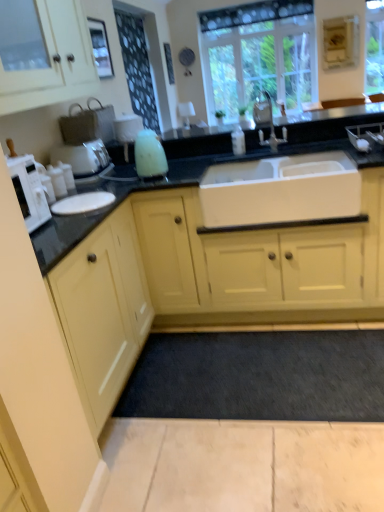
Question: Considering the positions of black granite countertop at center and matte yellow cabinet at left, the 1th cabinetry in the bottom-to-top sequence, in the image, is black granite countertop at center taller or shorter than matte yellow cabinet at left, the 1th cabinetry in the bottom-to-top sequence,?

Choices:
 (A) short
 (B) tall

Answer: (A)

Question: In terms of width, does black granite countertop at center look wider or thinner when compared to matte yellow cabinet at left, the 1th cabinetry in the bottom-to-top sequence?

Choices:
 (A) wide
 (B) thin

Answer: (A)

Question: Which is nearer to the white matte microwave at left?

Choices:
 (A) black granite countertop at center
 (B) matte white coffee machine at left
 (C) clear glass window at upper center
 (D) matte yellow cabinet at left, the 1th cabinetry in the bottom-to-top sequence
 (E) matte white cabinet at upper left, arranged as the first cabinetry when viewed from the top

Answer: (D)

Question: Which is nearer to the dark gray carpet at lower center?

Choices:
 (A) clear glass window at upper center
 (B) black granite countertop at center
 (C) white matte microwave at left
 (D) white matte sink at center
 (E) matte white cabinet at upper left, arranged as the second cabinetry when ordered from the bottom

Answer: (D)